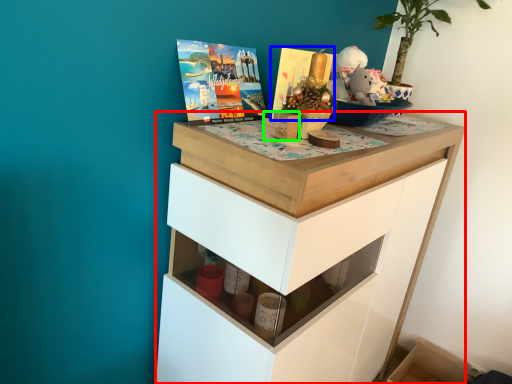
Question: Considering the real-world distances, which object is farthest from chest of drawers (highlighted by a red box)? magazine (highlighted by a blue box) or box (highlighted by a green box)?

Choices:
 (A) magazine
 (B) box

Answer: (A)